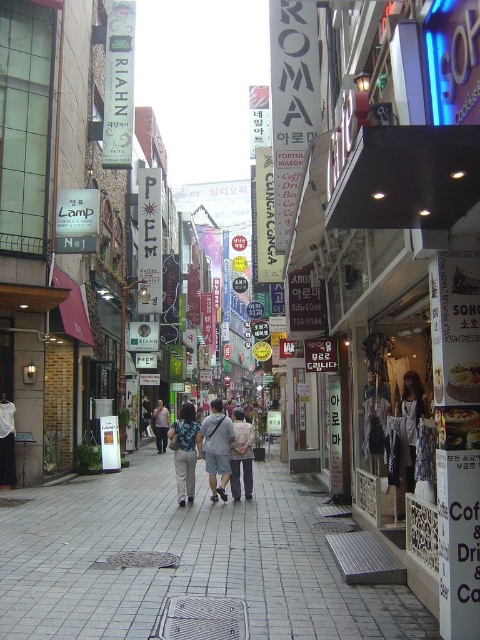
Which is above, light blue denim shorts at center or light blue denim pants at center?

light blue denim shorts at center is higher up.

Does light blue denim shorts at center have a smaller size compared to light blue denim pants at center?

Correct, light blue denim shorts at center occupies less space than light blue denim pants at center.

Which is in front, point (213, 490) or point (164, 444)?

Positioned in front is point (213, 490).

Locate an element on the screen. light blue denim shorts at center is located at coordinates (216, 449).

Does point (226, 436) lie behind point (162, 422)?

No, (226, 436) is in front of (162, 422).

Does light brown fabric pants at center have a smaller size compared to light blue denim pants at center?

Yes.

Which is behind, point (210, 460) or point (168, 419)?

Point (168, 419)

Where is `light brown fabric pants at center`? The height and width of the screenshot is (640, 480). light brown fabric pants at center is located at coordinates (204, 449).

Who is higher up, gray tile pavement at center or light blue denim shorts at center?

light blue denim shorts at center is higher up.

The height and width of the screenshot is (640, 480). I want to click on gray tile pavement at center, so click(184, 561).